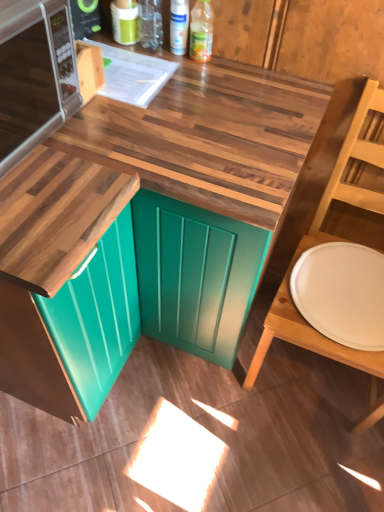
Identify the location of vacant area that lies to the right of translucent plastic bottle at upper center, which is the second bottle in left-to-right order. (249, 71).